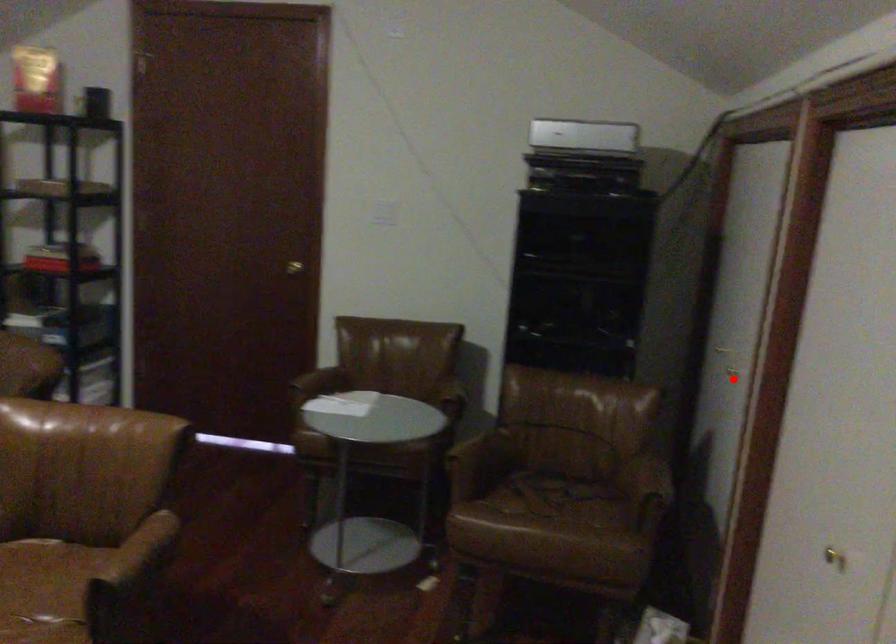
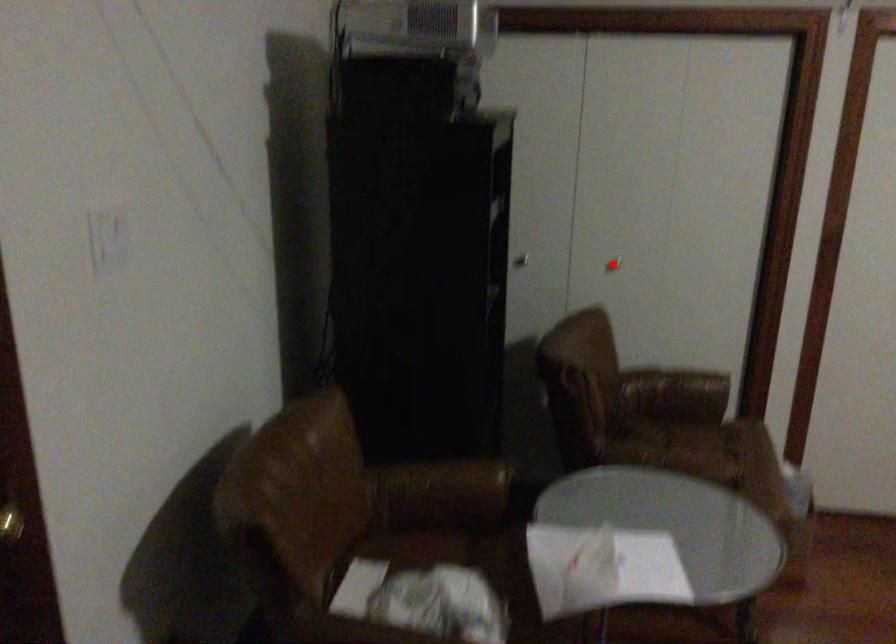
I am providing you with two images of the same scene from different viewpoints. A red point is marked on the first image and another point is marked on the second image. Are the points marked in image1 and image2 representing the same 3D position?

Yes